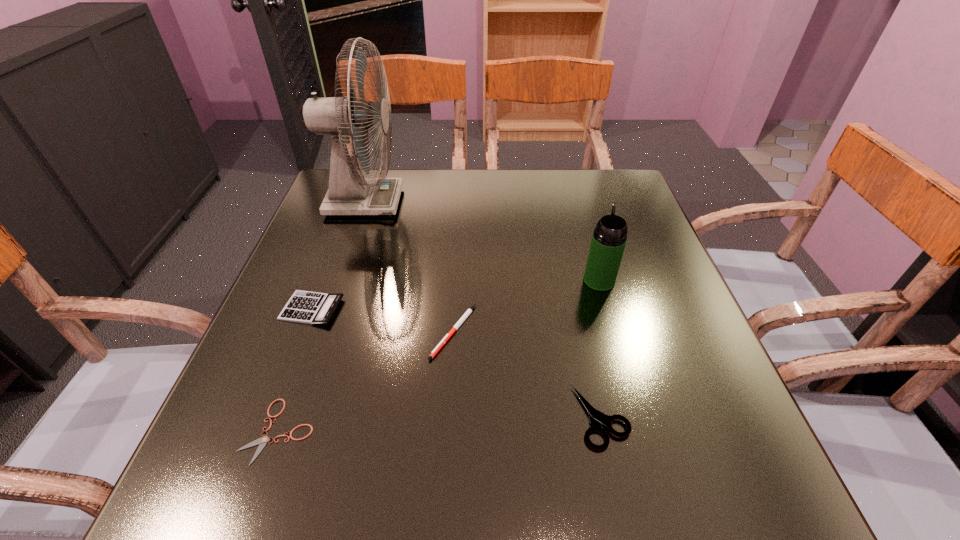
Locate an element on the screen. The width and height of the screenshot is (960, 540). fan is located at coordinates (343, 117).

The image size is (960, 540). Identify the location of the tallest object. (x=343, y=117).

Locate an element on the screen. The width and height of the screenshot is (960, 540). the fifth shortest object is located at coordinates (609, 238).

Where is `the third tallest object`? the third tallest object is located at coordinates (307, 307).

In order to click on the fourth object from left to right in this screenshot , I will do `click(469, 311)`.

Where is `the right shears`? the right shears is located at coordinates (596, 417).

I want to click on the shortest object, so pyautogui.click(x=262, y=441).

Identify the location of the shorter shears. This screenshot has width=960, height=540. (262, 441).

Locate an element on the screen. This screenshot has width=960, height=540. vacant area located 0.080m on the front-facing side of the farthest object is located at coordinates (431, 202).

Locate an element on the screen. vacant space located 0.300m from the spout of the fifth shortest object is located at coordinates (575, 195).